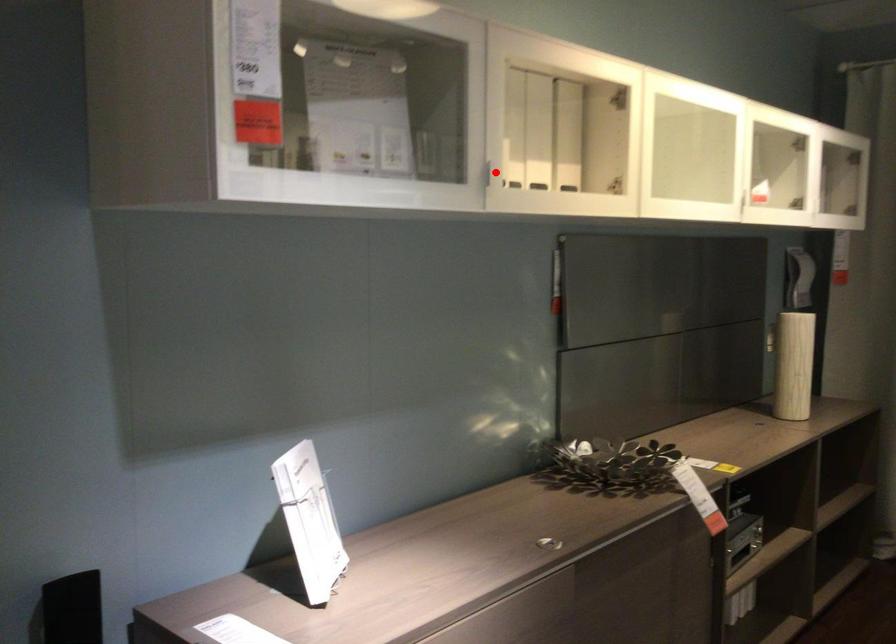
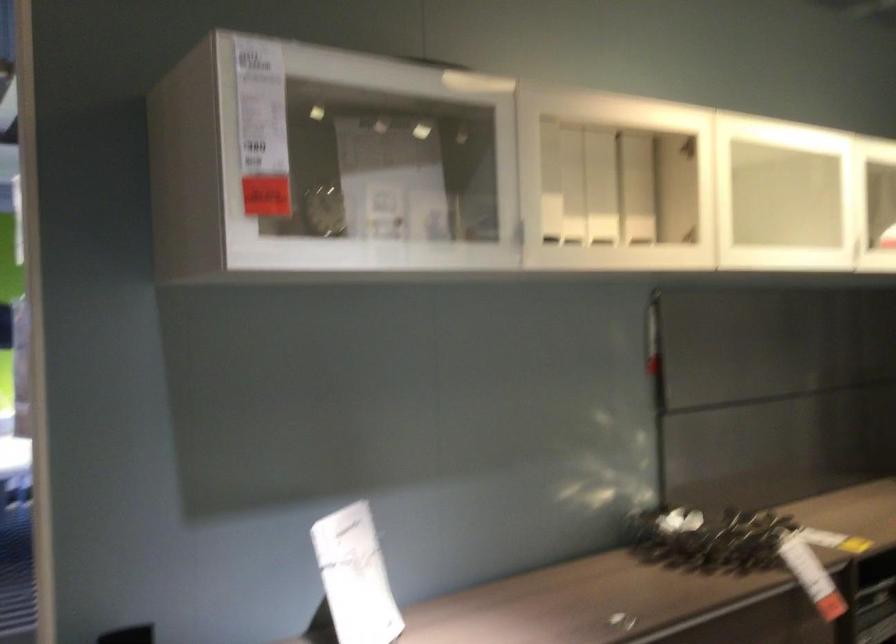
Question: I am providing you with two images of the same scene from different viewpoints. A red point is marked on the first image. Is the red point's position out of view in image 2?

Choices:
 (A) Yes
 (B) No

Answer: (B)